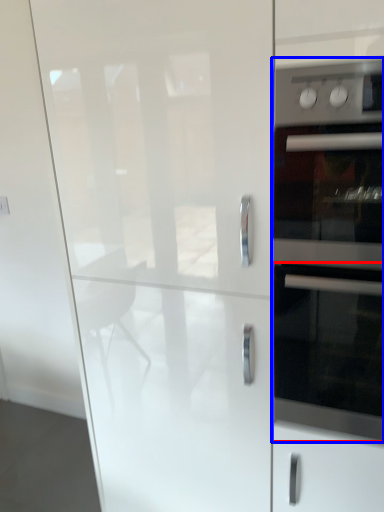
Question: Which point is further to the camera, oven (highlighted by a red box) or home appliance (highlighted by a blue box)?

Choices:
 (A) oven
 (B) home appliance

Answer: (A)